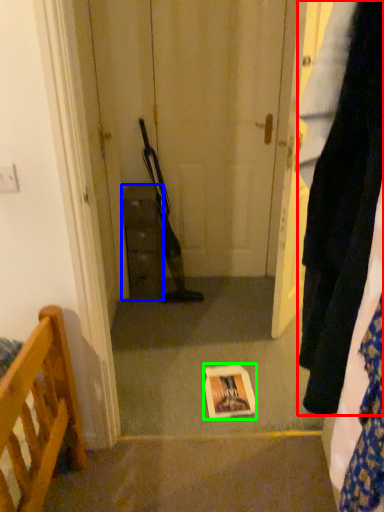
Question: Based on their relative distances, which object is farther from clothing (highlighted by a red box)? Choose from cabinetry (highlighted by a blue box) and copy (highlighted by a green box).

Choices:
 (A) cabinetry
 (B) copy

Answer: (A)